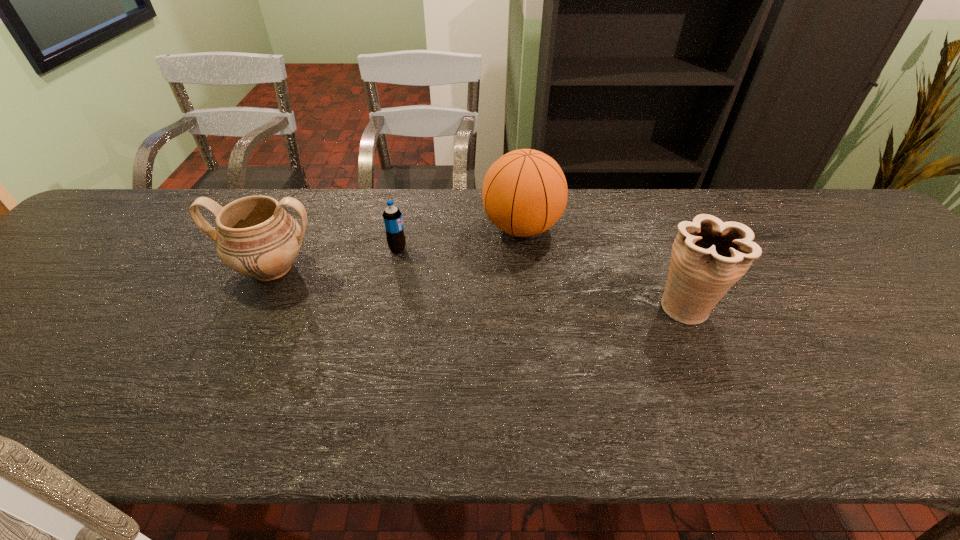
This screenshot has height=540, width=960. I want to click on basketball, so click(x=524, y=193).

The height and width of the screenshot is (540, 960). I want to click on the right urn, so click(709, 256).

You are a GUI agent. You are given a task and a screenshot of the screen. Output one action in this format:
    pyautogui.click(x=<x>, y=<y>)
    Task: Click on the left urn
    This screenshot has height=540, width=960.
    Given the screenshot: What is the action you would take?
    pyautogui.click(x=256, y=237)

Identify the location of the third object from right to left. The image size is (960, 540). (392, 217).

The height and width of the screenshot is (540, 960). In order to click on the shortest object in this screenshot , I will do `click(392, 217)`.

Locate an element on the screen. Image resolution: width=960 pixels, height=540 pixels. free location located on the right of the basketball is located at coordinates (625, 228).

I want to click on free space located 0.080m on the right of the rightmost object, so click(x=754, y=307).

Identify the location of vacant space located 0.190m on the front-facing side of the leftmost object. (226, 361).

The width and height of the screenshot is (960, 540). I want to click on vacant space located on the left of the third object from right to left, so click(x=265, y=248).

Image resolution: width=960 pixels, height=540 pixels. In order to click on object present at the far edge in this screenshot , I will do point(524,193).